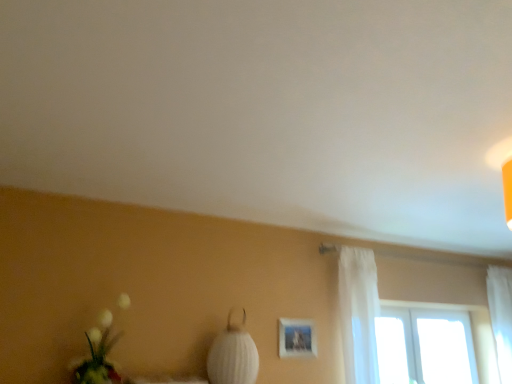
This screenshot has height=384, width=512. What do you see at coordinates (98, 355) in the screenshot?
I see `white fluffy bouquet at lower left` at bounding box center [98, 355].

This screenshot has width=512, height=384. I want to click on matte white picture frame at center, so click(297, 338).

Who is taller, transparent glass window at upper right or white sheer curtain at right, which is the second curtain from left to right?

white sheer curtain at right, which is the second curtain from left to right.

From a real-world perspective, who is located lower, transparent glass window at upper right or white sheer curtain at right, marked as the 1th curtain in a back-to-front arrangement?

transparent glass window at upper right.

Can we say transparent glass window at upper right lies outside white sheer curtain at right, which is the second curtain from left to right?

That's correct, transparent glass window at upper right is outside of white sheer curtain at right, which is the second curtain from left to right.

Consider the image. Is transparent glass window at upper right facing towards white sheer curtain at right, the first curtain when ordered from right to left?

Yes, transparent glass window at upper right is aimed at white sheer curtain at right, the first curtain when ordered from right to left.

Considering the relative sizes of matte white picture frame at center and white fabric lampshade at center in the image provided, is matte white picture frame at center shorter than white fabric lampshade at center?

Yes.

Which of these two, matte white picture frame at center or white fabric lampshade at center, is thinner?

With smaller width is matte white picture frame at center.

Is point (290, 332) closer to camera compared to point (218, 345)?

No, (290, 332) is further to viewer.

In the image, is matte white picture frame at center on the left side or the right side of white fabric lampshade at center?

In the image, matte white picture frame at center appears on the right side of white fabric lampshade at center.

Could you tell me if white sheer curtain at right, arranged as the 2th curtain when viewed from the right, is facing white fabric lampshade at center?

No, white sheer curtain at right, arranged as the 2th curtain when viewed from the right, is not oriented towards white fabric lampshade at center.

Identify the location of curtain that is the 1st object located behind the white fabric lampshade at center. tap(358, 313).

Is transparent glass window at upper right bigger than matte white picture frame at center?

Correct, transparent glass window at upper right is larger in size than matte white picture frame at center.

Can you confirm if transparent glass window at upper right is thinner than matte white picture frame at center?

Incorrect, the width of transparent glass window at upper right is not less than that of matte white picture frame at center.

This screenshot has height=384, width=512. I want to click on window on the right side of matte white picture frame at center, so click(x=434, y=344).

Can you see transparent glass window at upper right touching matte white picture frame at center?

transparent glass window at upper right is not next to matte white picture frame at center, and they're not touching.

Based on the photo, between transparent glass window at upper right and white fluffy bouquet at lower left, which one appears on the left side from the viewer's perspective?

From the viewer's perspective, white fluffy bouquet at lower left appears more on the left side.

Find the location of a particular element. Image resolution: width=512 pixels, height=384 pixels. window behind the white fluffy bouquet at lower left is located at coordinates (434, 344).

In terms of size, does transparent glass window at upper right appear bigger or smaller than white fluffy bouquet at lower left?

Clearly, transparent glass window at upper right is larger in size than white fluffy bouquet at lower left.

Is transparent glass window at upper right turned away from white fluffy bouquet at lower left?

transparent glass window at upper right is not turned away from white fluffy bouquet at lower left.

Which is more to the right, white fabric lampshade at center or white fluffy bouquet at lower left?

white fabric lampshade at center.

From a real-world perspective, is white fabric lampshade at center positioned over white fluffy bouquet at lower left based on gravity?

No, from a real-world perspective, white fabric lampshade at center is not above white fluffy bouquet at lower left.

In terms of height, does white fabric lampshade at center look taller or shorter compared to white fluffy bouquet at lower left?

white fabric lampshade at center is shorter than white fluffy bouquet at lower left.

Does white fabric lampshade at center contain white fluffy bouquet at lower left?

No, white fluffy bouquet at lower left is not inside white fabric lampshade at center.

Is matte white picture frame at center closer to the viewer compared to white sheer curtain at right, acting as the 2th curtain starting from the front?

Yes.

Is point (289, 331) positioned before point (505, 276)?

Yes, it is in front of point (505, 276).

Which of these two, matte white picture frame at center or white sheer curtain at right, acting as the 2th curtain starting from the front, is thinner?

With smaller width is matte white picture frame at center.

Find the location of a particular element. curtain that is the 1st one when counting upward from the transparent glass window at upper right (from the image's perspective) is located at coordinates (501, 317).

The width and height of the screenshot is (512, 384). Find the location of `table lamp that appears below the matte white picture frame at center (from a real-world perspective)`. table lamp that appears below the matte white picture frame at center (from a real-world perspective) is located at coordinates (233, 355).

When comparing their distances from white sheer curtain at right, the second curtain positioned from the back, does transparent glass window at upper right or white sheer curtain at right, acting as the 2th curtain starting from the front, seem closer?

transparent glass window at upper right lies closer to white sheer curtain at right, the second curtain positioned from the back, than the other object.

In the scene shown: When comparing their distances from transparent glass window at upper right, does white sheer curtain at right, the first curtain when ordered from right to left, or white fabric lampshade at center seem closer?

Among the two, white sheer curtain at right, the first curtain when ordered from right to left, is located nearer to transparent glass window at upper right.

Considering their positions, is transparent glass window at upper right positioned further to white sheer curtain at right, marked as the first curtain in a left-to-right arrangement, than white fabric lampshade at center?

The object further to white sheer curtain at right, marked as the first curtain in a left-to-right arrangement, is white fabric lampshade at center.

Estimate the real-world distances between objects in this image. Which object is further from white fluffy bouquet at lower left, matte white picture frame at center or white sheer curtain at right, acting as the 2th curtain starting from the front?

Among the two, white sheer curtain at right, acting as the 2th curtain starting from the front, is located further to white fluffy bouquet at lower left.

In the scene shown: When comparing their distances from transparent glass window at upper right, does white sheer curtain at right, the second curtain positioned from the back, or matte white picture frame at center seem further?

matte white picture frame at center is positioned further to the anchor transparent glass window at upper right.

From the image, which object appears to be farther from white sheer curtain at right, the first curtain when ordered from right to left, white sheer curtain at right, marked as the first curtain in a left-to-right arrangement, or white fabric lampshade at center?

Based on the image, white fabric lampshade at center appears to be further to white sheer curtain at right, the first curtain when ordered from right to left.

From the image, which object appears to be farther from white fabric lampshade at center, transparent glass window at upper right or white fluffy bouquet at lower left?

transparent glass window at upper right is positioned further to the anchor white fabric lampshade at center.

Looking at the image, which one is located further to white sheer curtain at right, marked as the 1th curtain in a back-to-front arrangement, white fluffy bouquet at lower left or white sheer curtain at right, arranged as the 2th curtain when viewed from the right?

white fluffy bouquet at lower left.

In order to click on picture frame between white fluffy bouquet at lower left and transparent glass window at upper right from left to right in this screenshot , I will do `click(297, 338)`.

The width and height of the screenshot is (512, 384). In order to click on window between white fabric lampshade at center and white sheer curtain at right, the first curtain when ordered from right to left, in the horizontal direction in this screenshot , I will do `click(434, 344)`.

Where is `curtain between white fluffy bouquet at lower left and white sheer curtain at right, the first curtain when ordered from right to left, in the horizontal direction`? The image size is (512, 384). curtain between white fluffy bouquet at lower left and white sheer curtain at right, the first curtain when ordered from right to left, in the horizontal direction is located at coordinates (358, 313).

This screenshot has width=512, height=384. What are the coordinates of `picture frame situated between white fluffy bouquet at lower left and white sheer curtain at right, which is the second curtain from left to right, from left to right` in the screenshot? It's located at (297, 338).